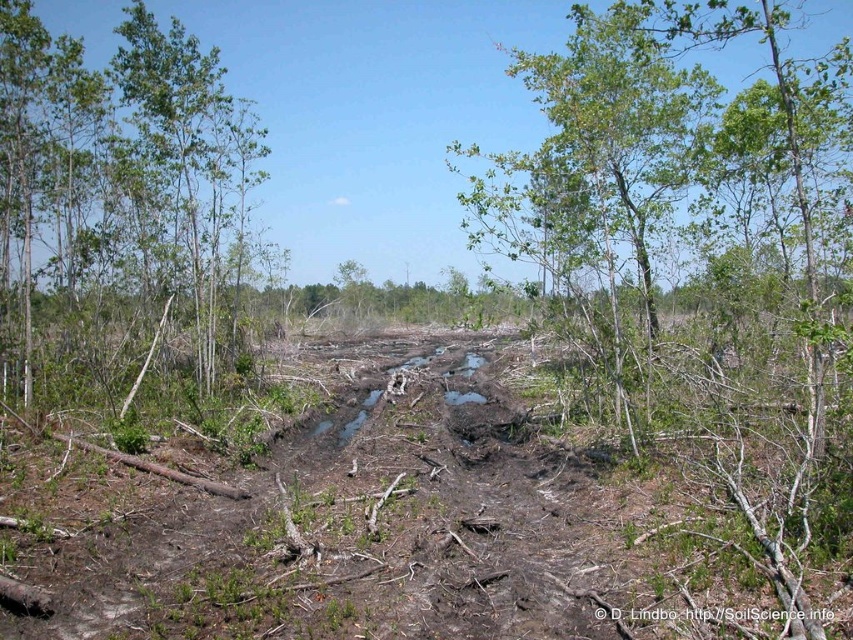
Who is more forward, (596,129) or (132,298)?

Point (596,129)

Which of these two, green leafy tree at center or green leafy tree at upper left, stands shorter?

green leafy tree at upper left is shorter.

Image resolution: width=853 pixels, height=640 pixels. In order to click on green leafy tree at center in this screenshot , I will do `click(694, 253)`.